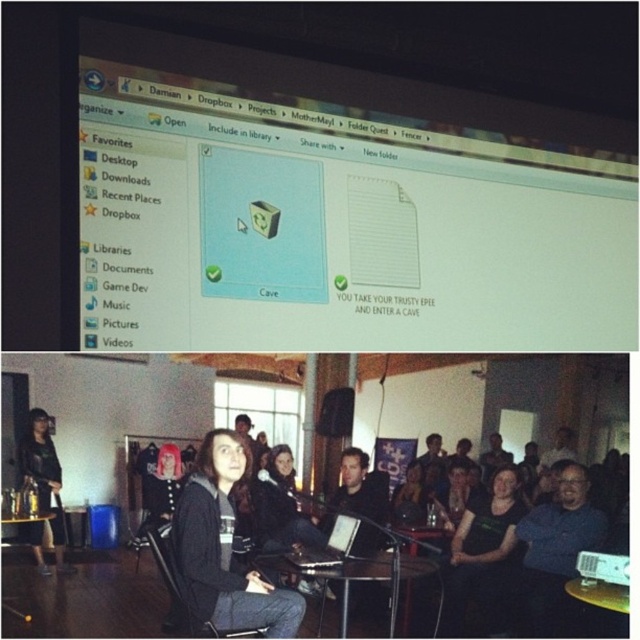
You are standing in a room and see a black fabric chair at center. If you want to sit down, will you be able to reach the chair without moving closer than 1.64 meters?

The distance between you and the black fabric chair at center is 1.64 meters, so you can reach it without needing to move closer than that distance.

You are organizing files on your computer and notice two items at the center of your screen. The blue glossy folder at center and the black leather jacket at center. Which one is positioned higher on the screen?

The blue glossy folder at center is located above the black leather jacket at center, so it is positioned higher on the screen.